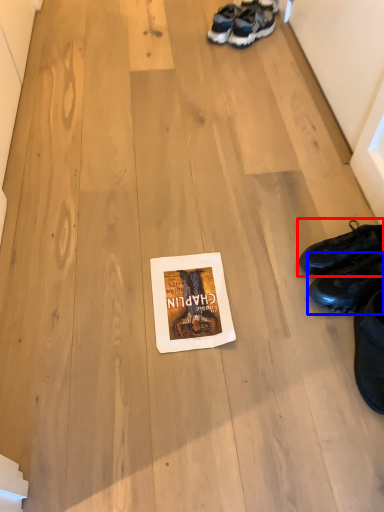
Question: Which point is closer to the camera, footwear (highlighted by a red box) or footwear (highlighted by a blue box)?

Choices:
 (A) footwear
 (B) footwear

Answer: (B)